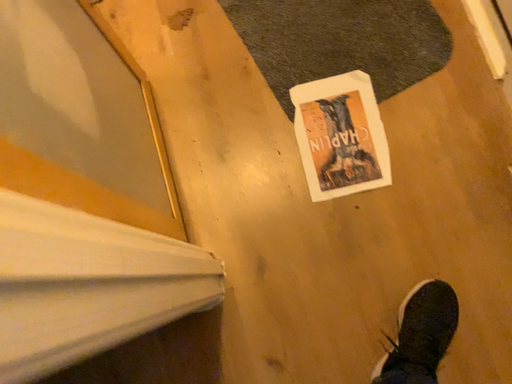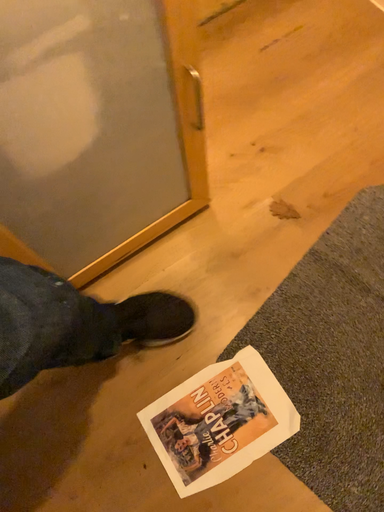
Question: Which way did the camera rotate in the video?

Choices:
 (A) rotated downward
 (B) rotated upward

Answer: (B)